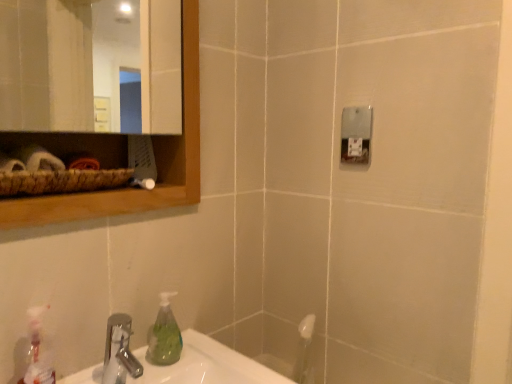
Question: From the image's perspective, is silver metallic faucet at lower left located above or below green translucent soap dispenser at lower left?

Choices:
 (A) below
 (B) above

Answer: (A)

Question: Does point (129, 314) appear closer or farther from the camera than point (178, 355)?

Choices:
 (A) farther
 (B) closer

Answer: (B)

Question: Estimate the real-world distances between objects in this image. Which object is closer to the green translucent soap dispenser at lower left?

Choices:
 (A) translucent plastic spray bottle at lower left
 (B) wooden mirror at upper left
 (C) silver metallic faucet at lower left

Answer: (C)

Question: Which of these objects is positioned closest to the silver metallic faucet at lower left?

Choices:
 (A) translucent plastic spray bottle at lower left
 (B) green translucent soap dispenser at lower left
 (C) wooden mirror at upper left

Answer: (B)